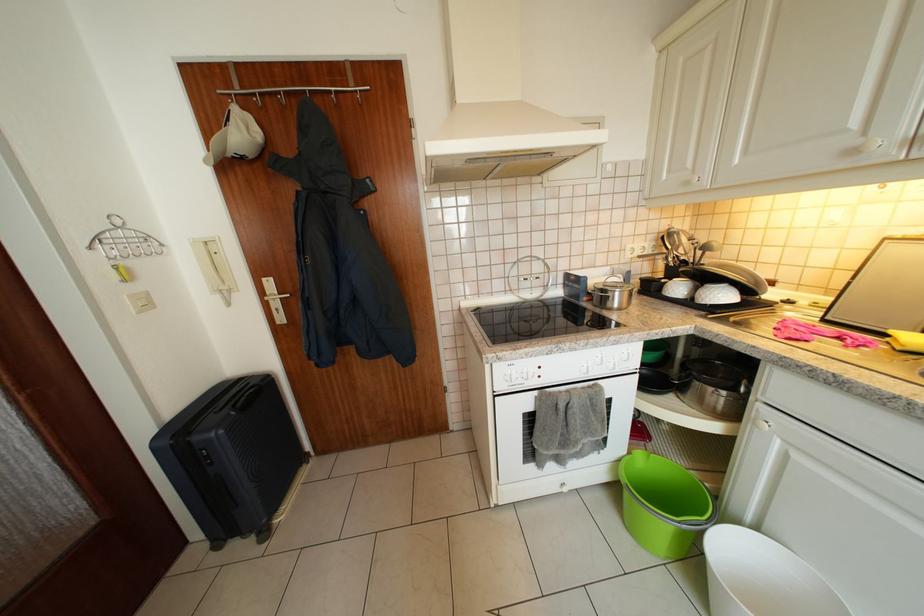
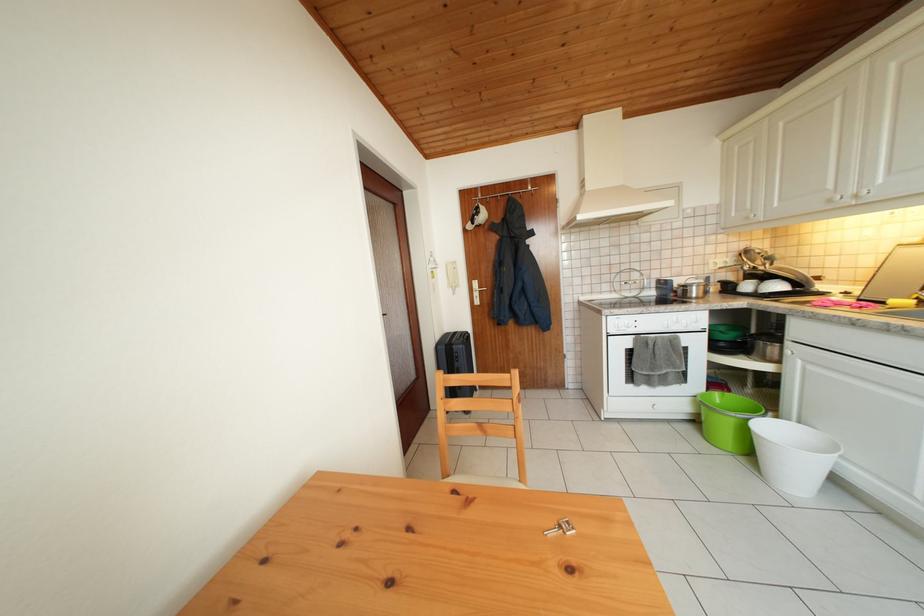
Question: Which direction would the cameraman need to move to produce the second image? Reply with the corresponding letter.

Choices:
 (A) Left
 (B) Right
 (C) Forward
 (D) Backward

Answer: (D)